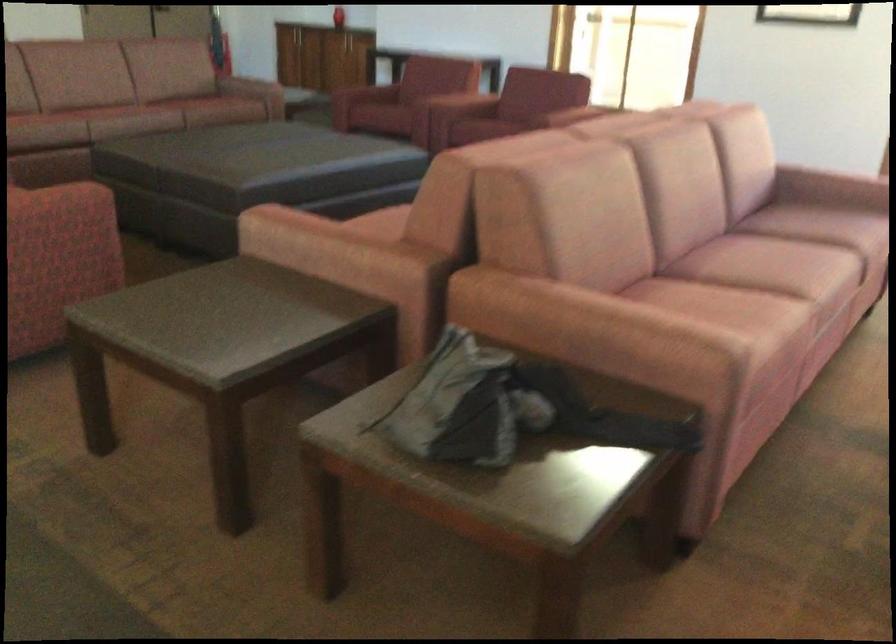
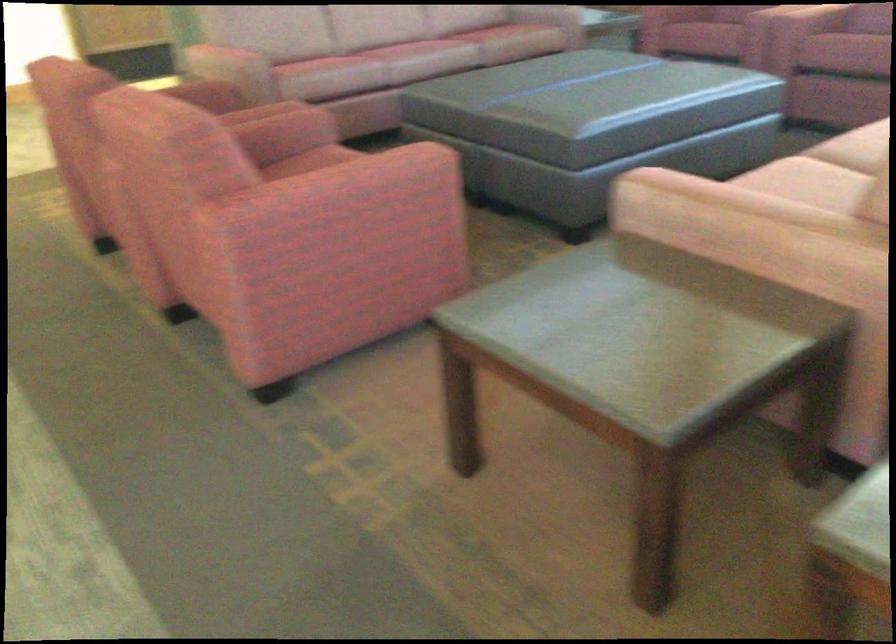
Question: The camera is either moving clockwise (left) or counter-clockwise (right) around the object. The first image is from the beginning of the video and the second image is from the end. Is the camera moving left or right when shooting the video?

Choices:
 (A) Left
 (B) Right

Answer: (B)